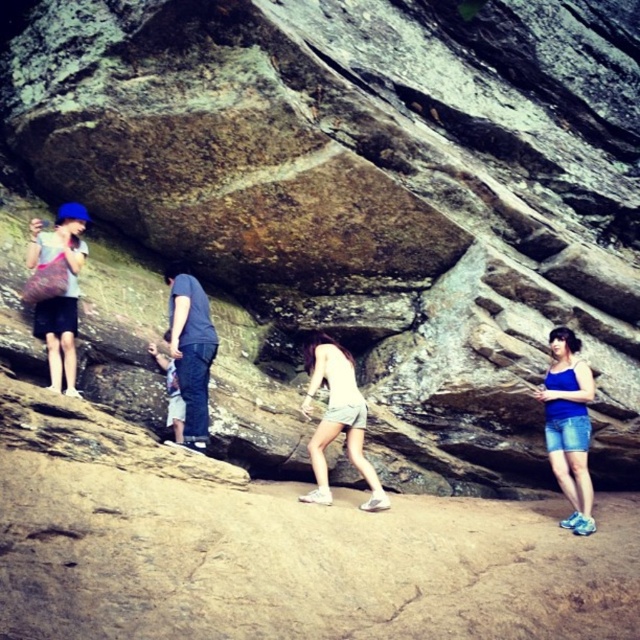
You are planning to cross the sandy path in the scene. You see the blue denim shorts at lower right and the dark blue jeans at center. Which clothing item is bigger in size?

The blue denim shorts at lower right has a larger size compared to the dark blue jeans at center, so the blue denim shorts at lower right is bigger.

You are a photographer trying to capture the group of four individuals near the large rock formation. You want to ensure the blue denim shorts at lower right are in the frame. Based on their 2D location coordinates, where should you position the camera to include them?

The blue denim shorts at lower right are located at point [568,426] in 2D coordinates. Position the camera so that the frame includes this coordinate to ensure the blue denim shorts at lower right are visible.